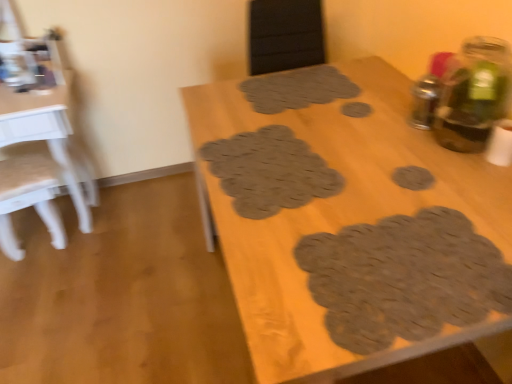
Locate an element on the screen. This screenshot has height=384, width=512. vacant space to the right of brown textured coaster at center-right, the second footprint in the bottom-to-top sequence is located at coordinates (466, 180).